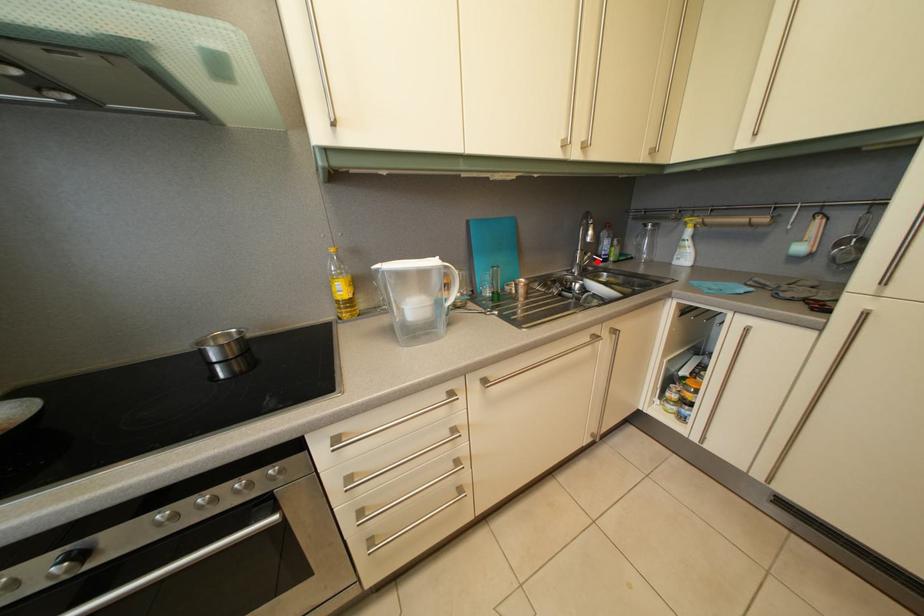
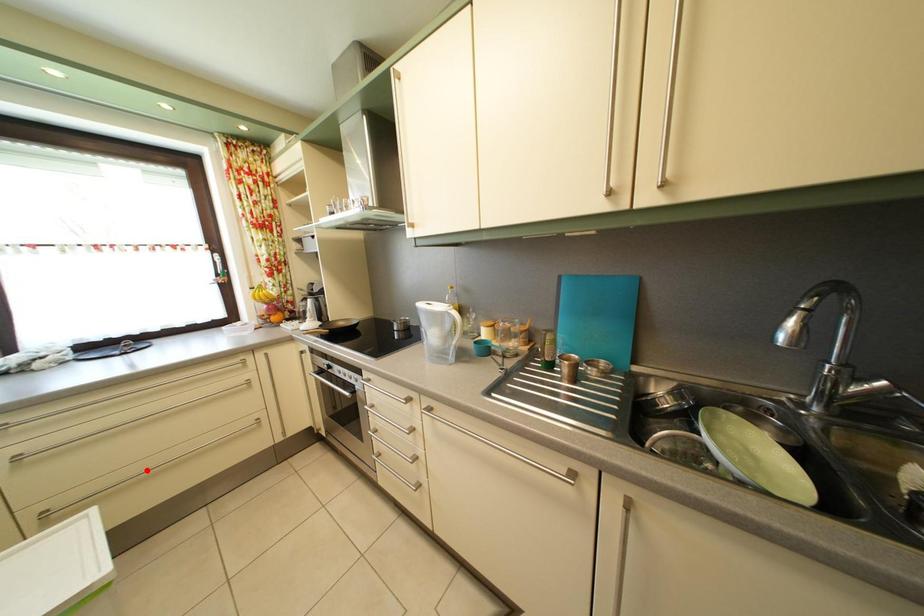
I am providing you with two images of the same scene from different viewpoints. A red point is marked on the first image and another point is marked on the second image. Do the highlighted points in image1 and image2 indicate the same real-world spot?

No